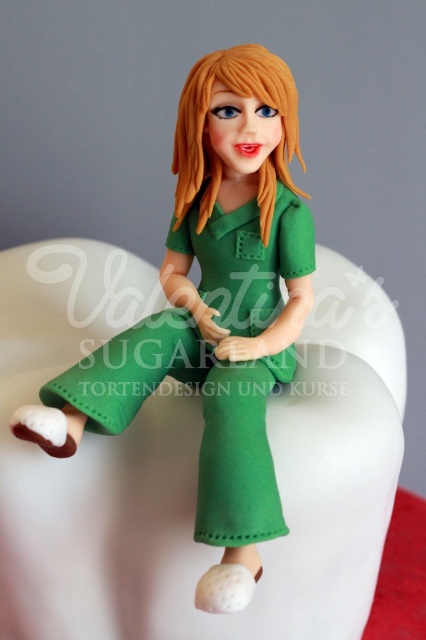
You are a tailor measuring the distance between the matte green dress at center and the blonde glossy hair at center for a custom alteration. The minimum required space for your tools is 4 inches. Can you proceed with the alterations?

The matte green dress at center and the blonde glossy hair at center are 3.73 inches apart, which is less than the required 4 inches. Therefore, you cannot proceed with the alterations.

You are a photographer adjusting your camera settings to capture the figurine in the image. The camera is set to a focal length of 50mm. To ensure the point at coordinates point (x=104, y=419) is in focus, what is the minimum distance in inches the camera should be from the figurine?

The point at coordinates point (x=104, y=419) is 35.33 inches from the camera. Therefore, the camera should be at least 35.33 inches away from the figurine to ensure this point is in focus.